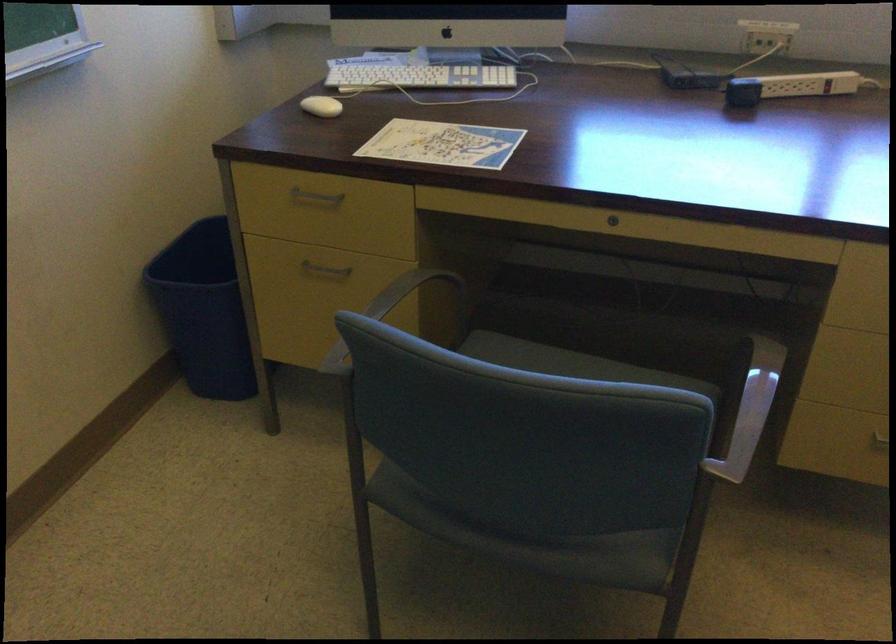
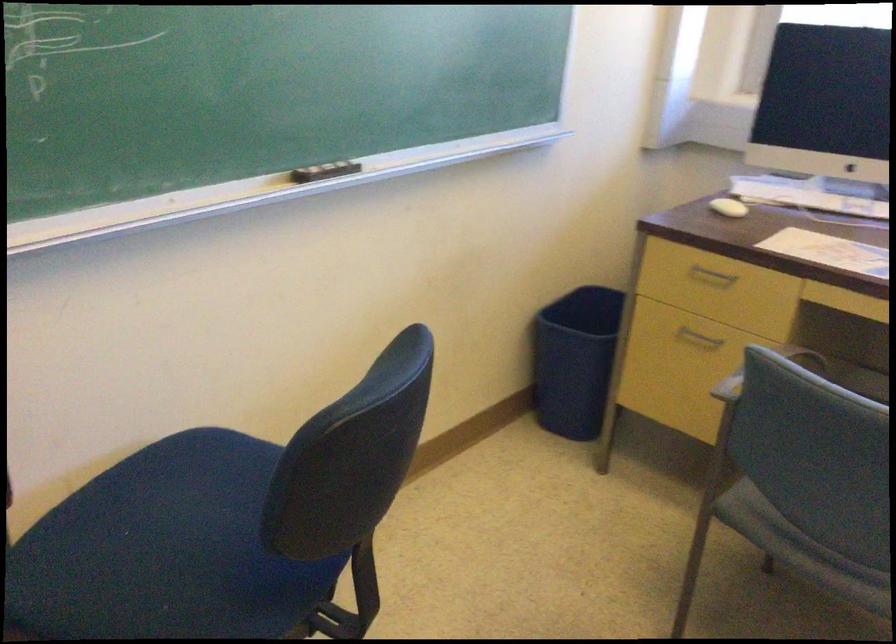
Where in the second image is the point corresponding to (317,276) from the first image?

(698, 337)